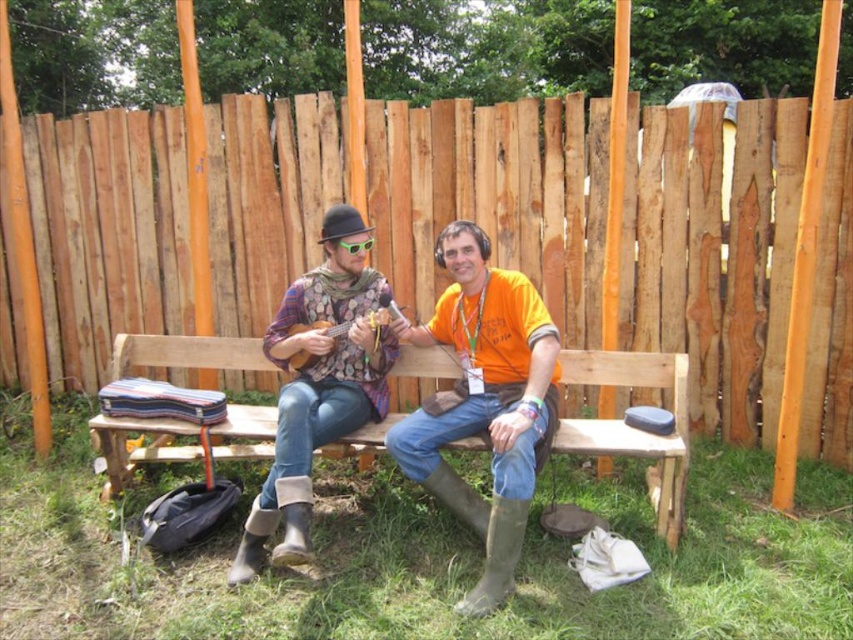
Is point (392, 356) closer to viewer compared to point (392, 301)?

No.

Is flannel shirt at center positioned at the back of wooden ukulele at center?

No, it is not.

Which is behind, point (329, 388) or point (381, 326)?

The point (381, 326) is behind.

In order to click on flannel shirt at center in this screenshot , I will do `click(318, 387)`.

What do you see at coordinates (384, 317) in the screenshot? The width and height of the screenshot is (853, 640). I see `wooden ukulele at center` at bounding box center [384, 317].

Between point (296, 358) and point (341, 241), which one is positioned in front?

Positioned in front is point (341, 241).

The height and width of the screenshot is (640, 853). What are the coordinates of `wooden ukulele at center` in the screenshot? It's located at (384, 317).

What do you see at coordinates (715, 260) in the screenshot? I see `wooden fence at center` at bounding box center [715, 260].

Based on the photo, who is positioned more to the right, wooden fence at center or flannel shirt at center?

From the viewer's perspective, wooden fence at center appears more on the right side.

Which is behind, point (732, 435) or point (355, 419)?

Point (732, 435)

This screenshot has width=853, height=640. What are the coordinates of `wooden fence at center` in the screenshot? It's located at (715, 260).